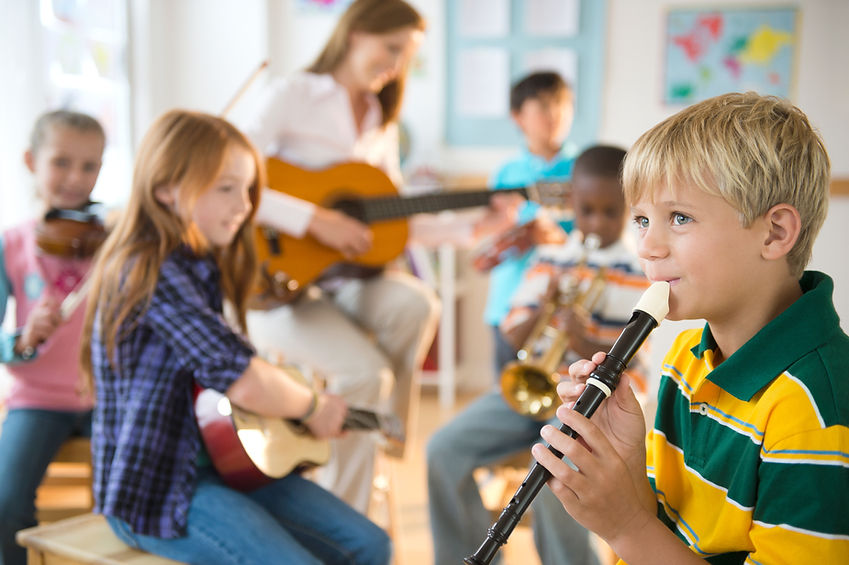
Where is `chair`? The image size is (849, 565). chair is located at coordinates (76, 546), (76, 452).